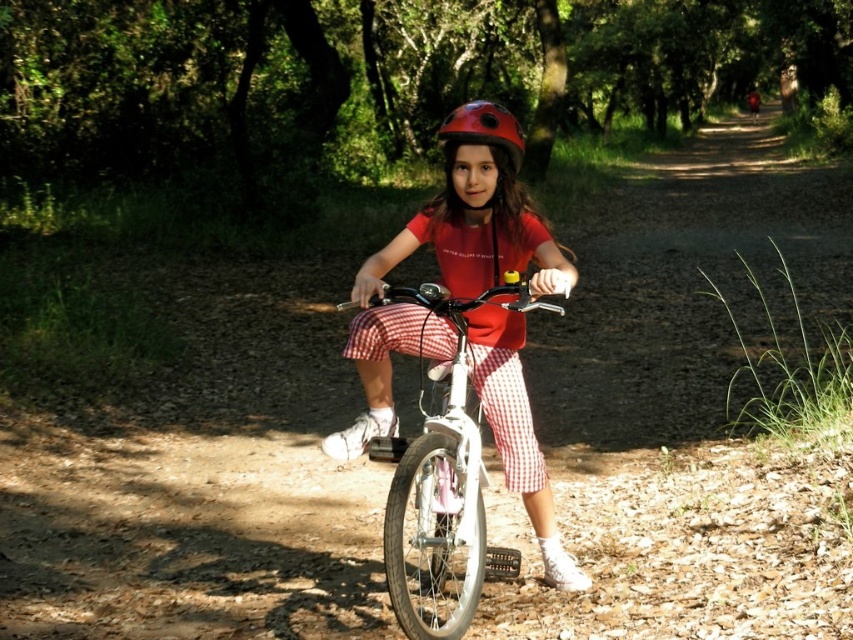
Question: Is white matte bicycle at center positioned before shiny red helmet at center?

Choices:
 (A) no
 (B) yes

Answer: (B)

Question: Is white matte bicycle at center below shiny red helmet at center?

Choices:
 (A) no
 (B) yes

Answer: (B)

Question: Observing the image, what is the correct spatial positioning of white matte bicycle at center in reference to shiny red helmet at center?

Choices:
 (A) left
 (B) right

Answer: (A)

Question: Among these objects, which one is farthest from the camera?

Choices:
 (A) shiny red helmet at center
 (B) white matte bicycle at center

Answer: (A)

Question: Which point is closer to the camera taking this photo?

Choices:
 (A) (515, 156)
 (B) (392, 540)

Answer: (B)

Question: Which object is closer to the camera taking this photo?

Choices:
 (A) shiny red helmet at center
 (B) white matte bicycle at center

Answer: (B)